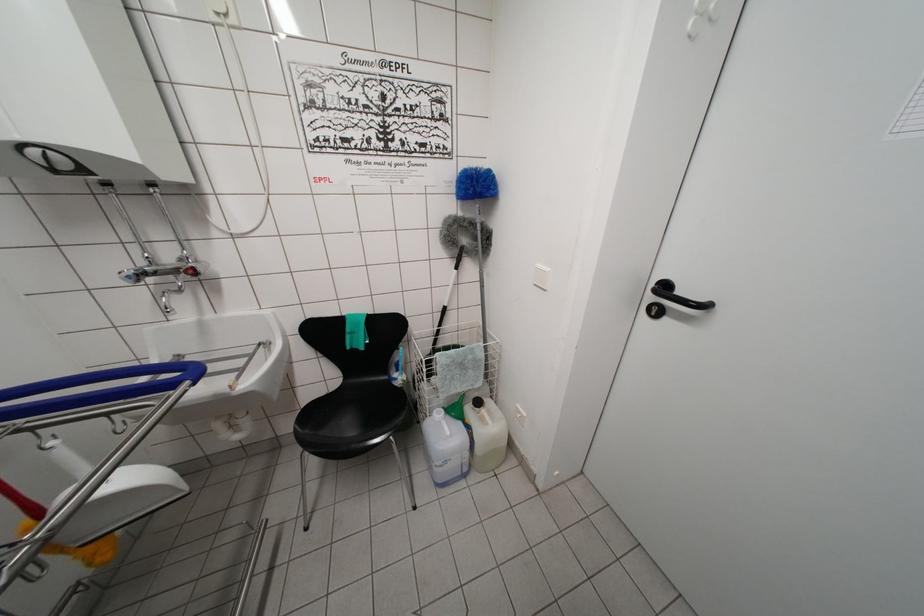
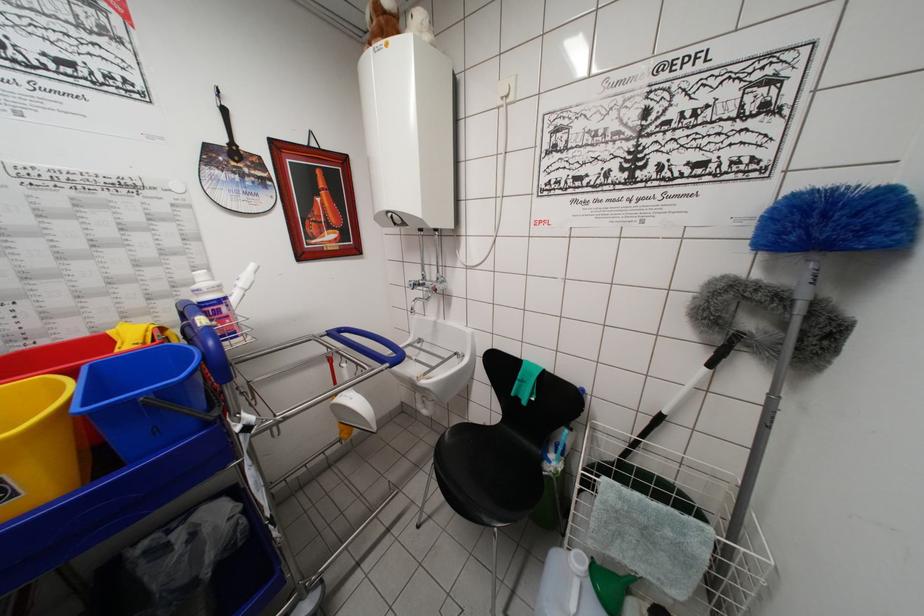
Where in the second image is the point corresponding to the point at 438,418 from the first image?

(576, 557)